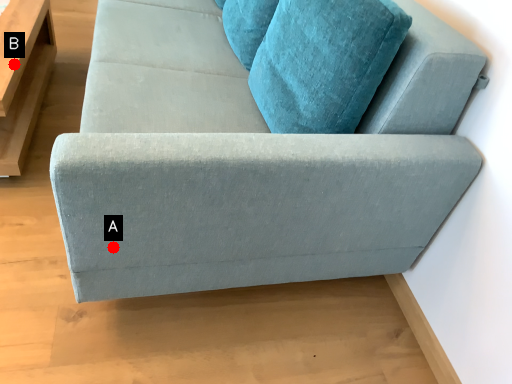
Question: Two points are circled on the image, labeled by A and B beside each circle. Which of the following is the farthest from the observer?

Choices:
 (A) A is further
 (B) B is further

Answer: (B)